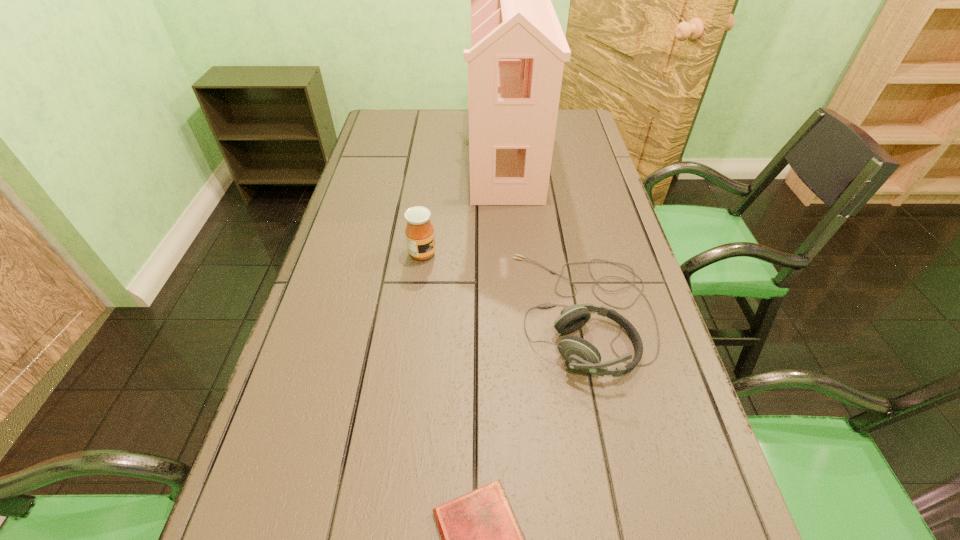
What are the coordinates of `dollhouse` in the screenshot? It's located at (515, 64).

Image resolution: width=960 pixels, height=540 pixels. I want to click on the tallest object, so click(515, 64).

Locate an element on the screen. The width and height of the screenshot is (960, 540). the leftmost object is located at coordinates (419, 231).

You are a GUI agent. You are given a task and a screenshot of the screen. Output one action in this format:
    pyautogui.click(x=<x>, y=<y>)
    Task: Click on the honey
    The height and width of the screenshot is (540, 960).
    Given the screenshot: What is the action you would take?
    pyautogui.click(x=419, y=231)

The image size is (960, 540). What are the coordinates of `headset` in the screenshot? It's located at (580, 354).

The height and width of the screenshot is (540, 960). Find the location of `free region located 0.150m on the front-facing side of the dollhouse`. free region located 0.150m on the front-facing side of the dollhouse is located at coordinates (423, 159).

You are a GUI agent. You are given a task and a screenshot of the screen. Output one action in this format:
    pyautogui.click(x=<x>, y=<y>)
    Task: Click on the free spot located 0.330m on the front-facing side of the dollhouse
    The width and height of the screenshot is (960, 540).
    Given the screenshot: What is the action you would take?
    pyautogui.click(x=369, y=159)

Identify the location of free spot located 0.350m on the front-facing side of the dollhouse. This screenshot has width=960, height=540. (362, 159).

At what (x,y) coordinates should I click in order to perform the action: click on vacant space situated 0.070m on the front-facing side of the leftmost object. Please return your answer as a coordinate pair (x, y). Image resolution: width=960 pixels, height=540 pixels. Looking at the image, I should click on (464, 254).

This screenshot has width=960, height=540. Find the location of `free space located 0.210m on the outer surface of the headset`. free space located 0.210m on the outer surface of the headset is located at coordinates (423, 312).